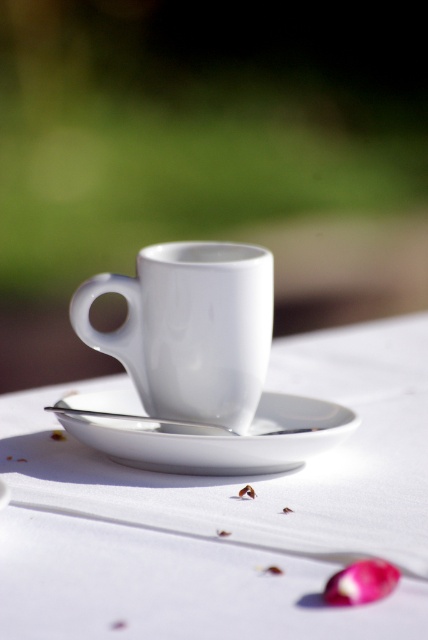
You are a barista arranging items on a table. You have a white glossy saucer at center and a silver metallic spoon at center. You need to place a small sugar cube between them. Is there enough space to fit the cube without moving the saucer or spoon?

The distance between the white glossy saucer at center and the silver metallic spoon at center is 0.85 inches. Since a standard sugar cube measures approximately 0.5 inches per side, there is sufficient space to place the sugar cube between them without moving either item.

You are setting up a table for a tea party and have a white glossy mug at center and a pink glossy onion at lower right. Which object should you avoid placing near the edge of the table to prevent it from falling off?

You should avoid placing the pink glossy onion at lower right near the edge of the table because it is smaller and less stable compared to the larger white glossy mug at center, which has a wider base and is less likely to tip over.

In the scene shown: You are an artist trying to sketch this scene. You want to place the white ceramic cup at center accurately. What are the coordinates where you should position it?

The white ceramic cup at center should be positioned at coordinates 0.805 on the x axis and 0.528 on the y axis.